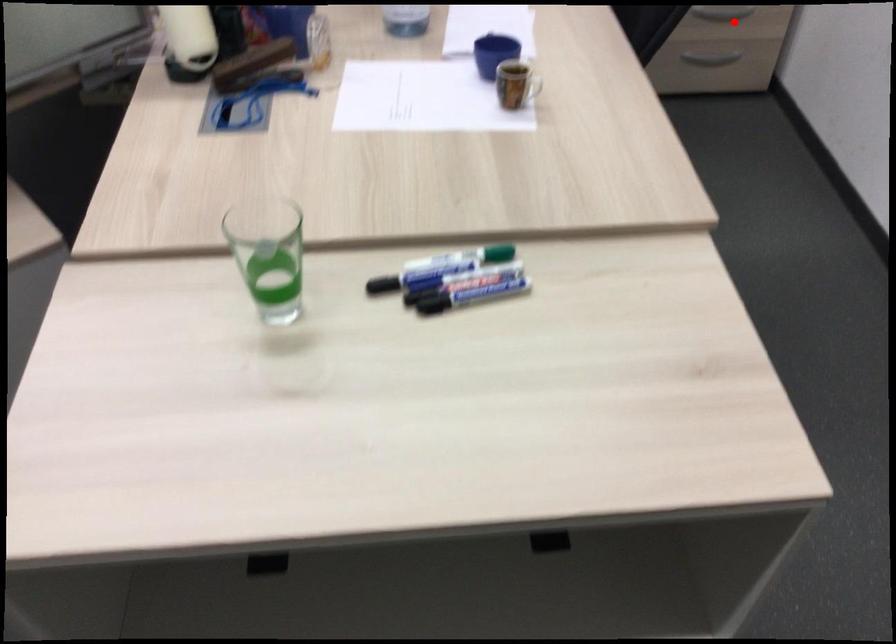
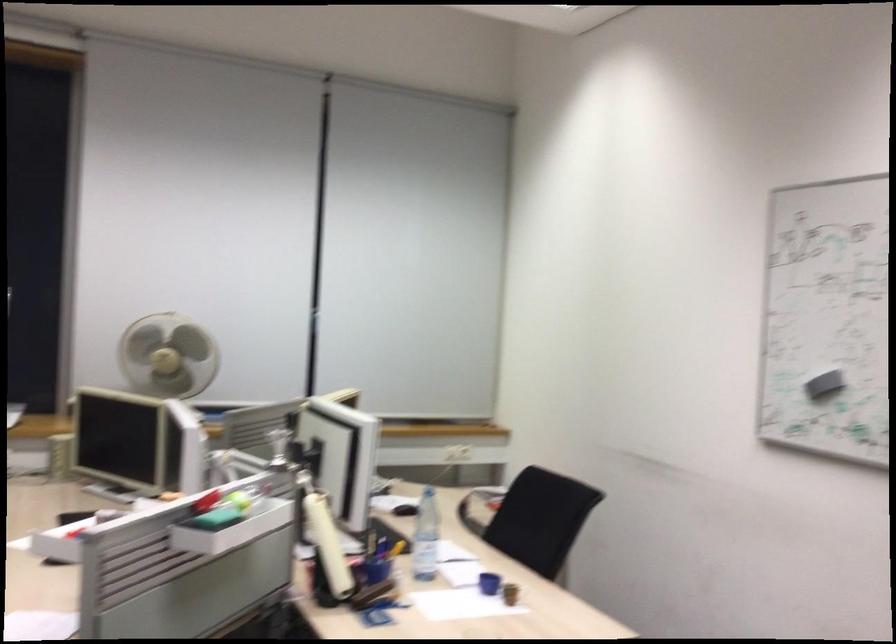
Question: I am providing you with two images of the same scene from different viewpoints. A red point is marked on the first image. At the location where the point appears in image 1, is it still visible in image 2?

Choices:
 (A) Yes
 (B) No

Answer: (B)